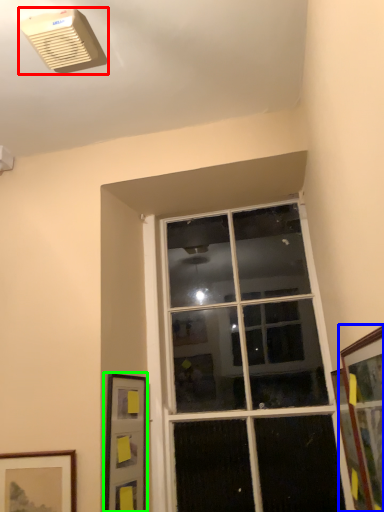
Question: Based on their relative distances, which object is farther from air conditioning (highlighted by a red box)? Choose from picture frame (highlighted by a blue box) and picture frame (highlighted by a green box).

Choices:
 (A) picture frame
 (B) picture frame

Answer: (B)